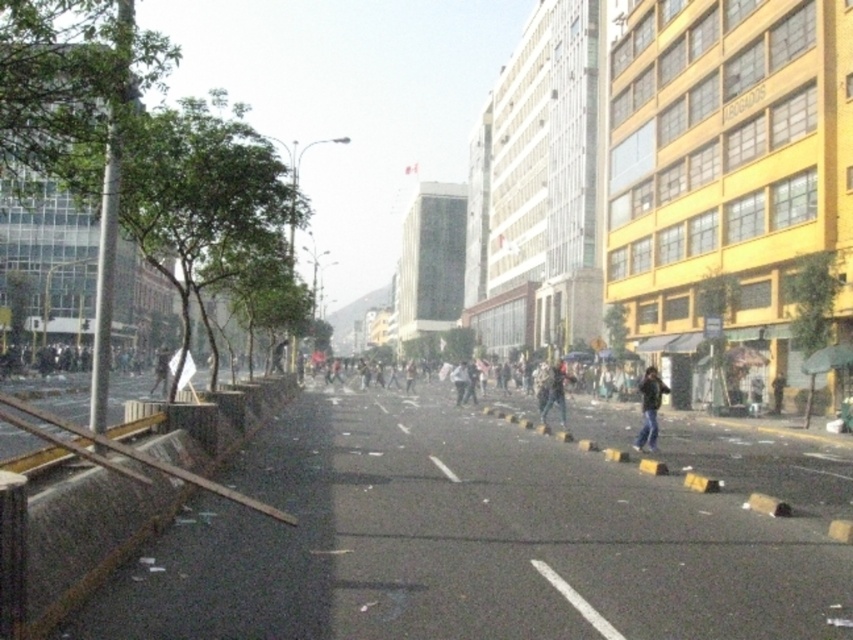
You are a city planner analyzing the layout of this urban street scene. The wooden barricade at left is placed at a specific coordinate. Can you determine its location relative to the center of the image?

The wooden barricade at left is located at point 0.780 on the x axis and 0.136 on the y axis, which places it to the right side of the image since the x coordinate is closer to 1.0, and slightly below the center vertically due to the y coordinate being closer to 0.0.

You are a delivery person trying to navigate through the street. You see the wooden barricade at left and the dark blue jeans at lower right. Which object is taller?

The dark blue jeans at lower right are taller than the wooden barricade at left.

You are a photographer positioned at the edge of the protest area. You want to capture both the dark blue jeans at lower right and the dark gray fabric jacket at center in your shot. Which object should you focus on first to ensure both are in frame?

The dark blue jeans at lower right is in front of the dark gray fabric jacket at center, so you should focus on the dark gray fabric jacket at center first to ensure both are in frame.